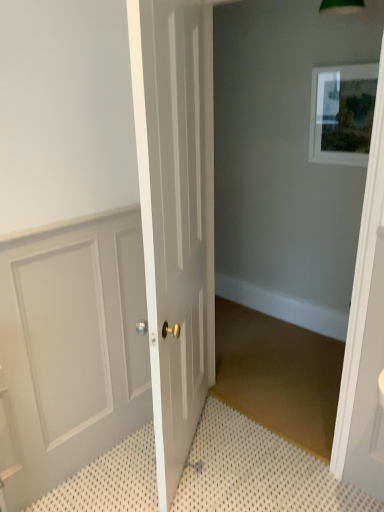
Question: Should I look upward or downward to see white panelled door at left, positioned as the first door in left-to-right order?

Choices:
 (A) up
 (B) down

Answer: (B)

Question: Does white panelled door at left, positioned as the first door in left-to-right order, have a lesser width compared to white glossy door at center, the second door positioned from the left?

Choices:
 (A) no
 (B) yes

Answer: (B)

Question: Can you confirm if white panelled door at left, marked as the second door in a right-to-left arrangement, is shorter than white glossy door at center, the second door positioned from the left?

Choices:
 (A) no
 (B) yes

Answer: (B)

Question: From a real-world perspective, does white panelled door at left, marked as the second door in a right-to-left arrangement, sit lower than white glossy door at center, the second door positioned from the left?

Choices:
 (A) no
 (B) yes

Answer: (B)

Question: From a real-world perspective, is white panelled door at left, marked as the second door in a right-to-left arrangement, located higher than white glossy door at center, the first door positioned from the right?

Choices:
 (A) no
 (B) yes

Answer: (A)

Question: Can you confirm if white panelled door at left, positioned as the first door in left-to-right order, is wider than white glossy door at center, the second door positioned from the left?

Choices:
 (A) no
 (B) yes

Answer: (A)

Question: Does white panelled door at left, marked as the second door in a right-to-left arrangement, come behind white glossy door at center, the first door positioned from the right?

Choices:
 (A) no
 (B) yes

Answer: (B)

Question: Can you confirm if white textured bath mat at lower left is bigger than white panelled door at left, positioned as the first door in left-to-right order?

Choices:
 (A) yes
 (B) no

Answer: (B)

Question: Can white panelled door at left, marked as the second door in a right-to-left arrangement, be found inside white textured bath mat at lower left?

Choices:
 (A) yes
 (B) no

Answer: (B)

Question: From a real-world perspective, is white textured bath mat at lower left under white panelled door at left, marked as the second door in a right-to-left arrangement?

Choices:
 (A) yes
 (B) no

Answer: (A)

Question: From a real-world perspective, is white textured bath mat at lower left physically above white panelled door at left, marked as the second door in a right-to-left arrangement?

Choices:
 (A) no
 (B) yes

Answer: (A)

Question: From the image's perspective, is white textured bath mat at lower left on top of white panelled door at left, positioned as the first door in left-to-right order?

Choices:
 (A) yes
 (B) no

Answer: (B)

Question: Considering the relative sizes of white textured bath mat at lower left and white panelled door at left, positioned as the first door in left-to-right order, in the image provided, is white textured bath mat at lower left smaller than white panelled door at left, positioned as the first door in left-to-right order,?

Choices:
 (A) no
 (B) yes

Answer: (B)

Question: From the image's perspective, does white textured bath mat at lower left appear lower than matte white picture frame at upper right?

Choices:
 (A) no
 (B) yes

Answer: (B)